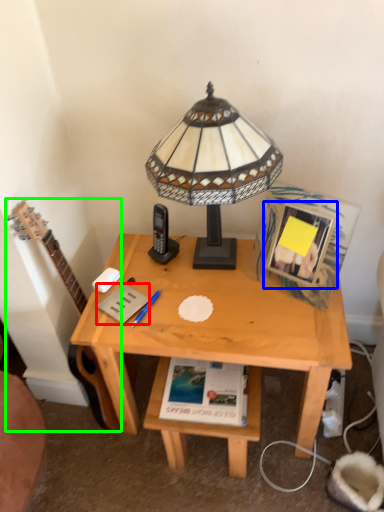
Question: Which object is positioned closest to paperback book (highlighted by a red box)? Select from picture frame (highlighted by a blue box) and guitar (highlighted by a green box).

Choices:
 (A) picture frame
 (B) guitar

Answer: (B)